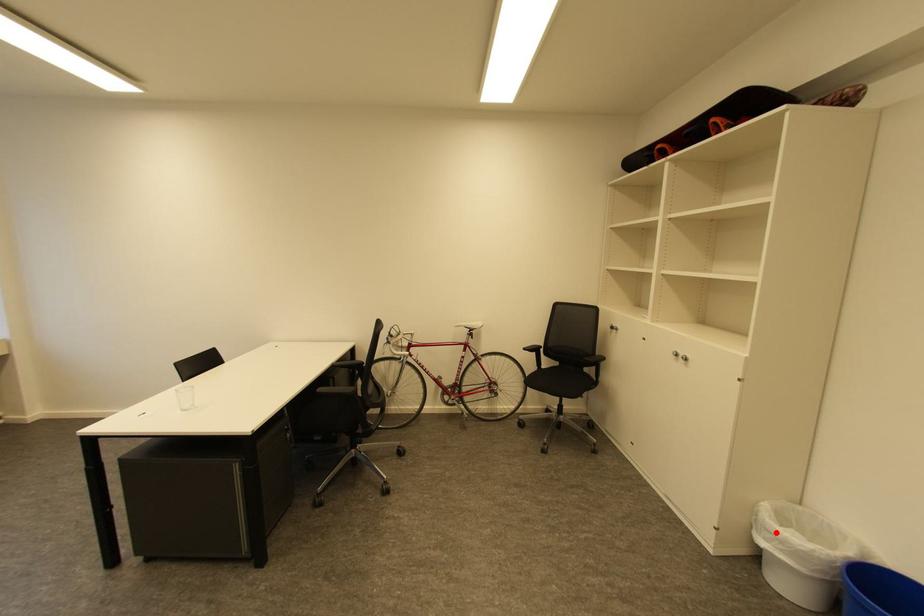
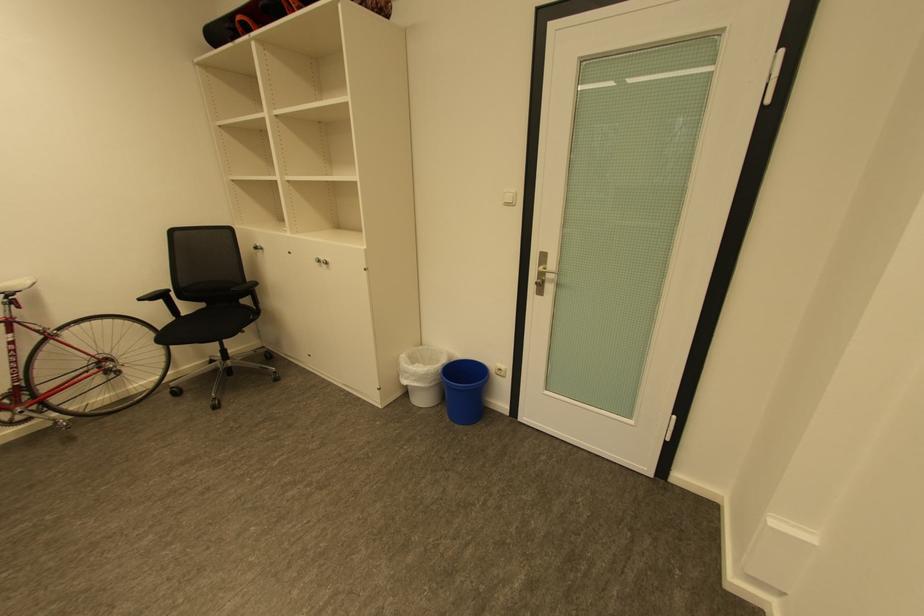
Question: I am providing you with two images of the same scene from different viewpoints. Given a red point in image1, look at the same physical point in image2. Is it:

Choices:
 (A) Closer to the viewpoint
 (B) Farther from the viewpoint

Answer: (A)